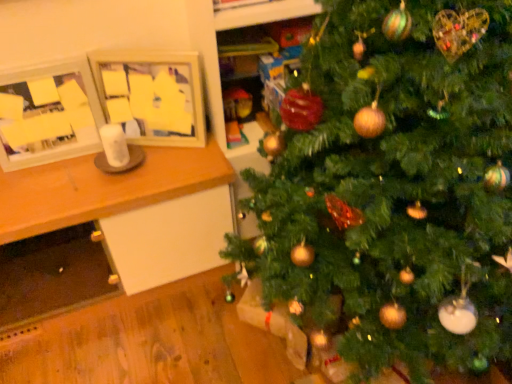
Question: Is wooden picture frame at upper left, acting as the second picture frame starting from the left, in contact with wooden table at left?

Choices:
 (A) no
 (B) yes

Answer: (A)

Question: From the image's perspective, is wooden picture frame at upper left, acting as the second picture frame starting from the left, over wooden table at left?

Choices:
 (A) no
 (B) yes

Answer: (B)

Question: Is wooden picture frame at upper left, acting as the second picture frame starting from the left, smaller than wooden table at left?

Choices:
 (A) yes
 (B) no

Answer: (A)

Question: Can you confirm if wooden picture frame at upper left, marked as the 1th picture frame in a right-to-left arrangement, is positioned to the left of wooden table at left?

Choices:
 (A) yes
 (B) no

Answer: (B)

Question: Considering the relative sizes of wooden picture frame at upper left, marked as the 1th picture frame in a right-to-left arrangement, and wooden table at left in the image provided, is wooden picture frame at upper left, marked as the 1th picture frame in a right-to-left arrangement, thinner than wooden table at left?

Choices:
 (A) no
 (B) yes

Answer: (B)

Question: Is wooden picture frame at upper left, marked as the 1th picture frame in a right-to-left arrangement, positioned with its back to wooden table at left?

Choices:
 (A) yes
 (B) no

Answer: (B)

Question: Does matte wooden picture frame at left, the first picture frame viewed from the left, appear on the right side of green matte christmas tree at center?

Choices:
 (A) yes
 (B) no

Answer: (B)

Question: Is matte wooden picture frame at left, the first picture frame viewed from the left, behind green matte christmas tree at center?

Choices:
 (A) yes
 (B) no

Answer: (A)

Question: Is matte wooden picture frame at left, the first picture frame viewed from the left, smaller than green matte christmas tree at center?

Choices:
 (A) no
 (B) yes

Answer: (B)

Question: Can you confirm if matte wooden picture frame at left, the first picture frame viewed from the left, is wider than green matte christmas tree at center?

Choices:
 (A) yes
 (B) no

Answer: (B)

Question: Would you say green matte christmas tree at center is part of matte wooden picture frame at left, the first picture frame viewed from the left,'s contents?

Choices:
 (A) no
 (B) yes

Answer: (A)

Question: Can you confirm if matte wooden picture frame at left, the second picture frame from the right, is bigger than green matte christmas tree at center?

Choices:
 (A) yes
 (B) no

Answer: (B)

Question: Is green matte christmas tree at center positioned far away from wooden picture frame at upper left, marked as the 1th picture frame in a right-to-left arrangement?

Choices:
 (A) yes
 (B) no

Answer: (B)